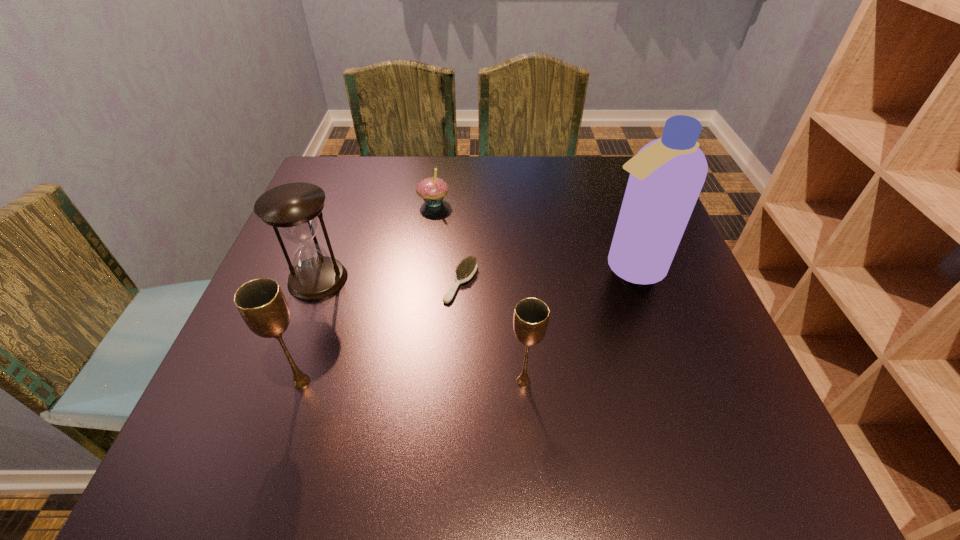
Observe the arrangement of all chalices in the image. To keep them evenly spaced, where would you place another chalice on the right? Please locate a free space. Please provide its 2D coordinates. Your answer should be formatted as a tuple, i.e. [(x, y)], where the tuple contains the x and y coordinates of a point satisfying the conditions above.

[(745, 381)]